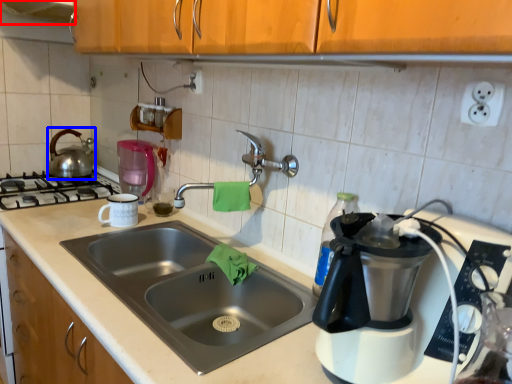
Question: Which object is closer to the camera taking this photo, exhaust hood (highlighted by a red box) or tea pot (highlighted by a blue box)?

Choices:
 (A) exhaust hood
 (B) tea pot

Answer: (A)